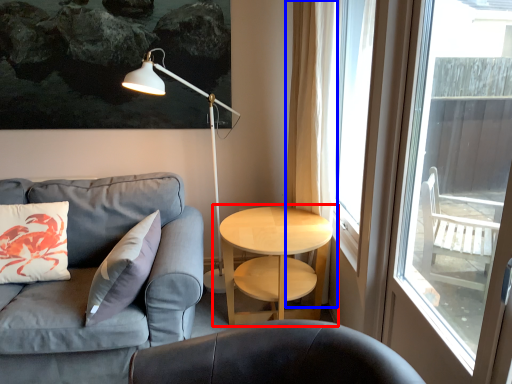
Question: Among these objects, which one is farthest to the camera, table (highlighted by a red box) or curtain (highlighted by a blue box)?

Choices:
 (A) table
 (B) curtain

Answer: (B)